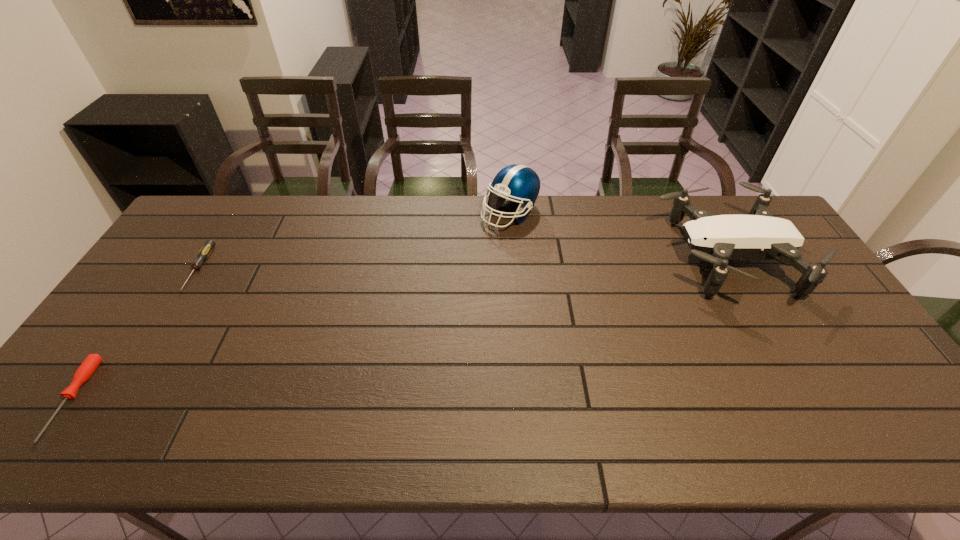
This screenshot has width=960, height=540. In order to click on free space located 0.380m on the camera side of the drone in this screenshot , I will do `click(540, 258)`.

Locate an element on the screen. This screenshot has height=540, width=960. free space located 0.370m insert the third object from right to left into a screw head is located at coordinates (108, 413).

Locate an element on the screen. The image size is (960, 540). football helmet located at the far edge is located at coordinates (519, 183).

The height and width of the screenshot is (540, 960). I want to click on drone present at the far edge, so click(757, 236).

Find the location of `object situated at the near edge`. object situated at the near edge is located at coordinates (87, 368).

What are the coordinates of `object present at the right edge` in the screenshot? It's located at (757, 236).

Where is `object present at the near left corner`? object present at the near left corner is located at coordinates (87, 368).

Where is `object positioned at the far right corner`? The height and width of the screenshot is (540, 960). object positioned at the far right corner is located at coordinates (757, 236).

In the image, there is a desktop. Identify the location of vacant space at the far edge. The width and height of the screenshot is (960, 540). (428, 228).

At what (x,y) coordinates should I click in order to perform the action: click on free spot at the near edge of the desktop. Please return your answer as a coordinate pair (x, y). Looking at the image, I should click on (542, 420).